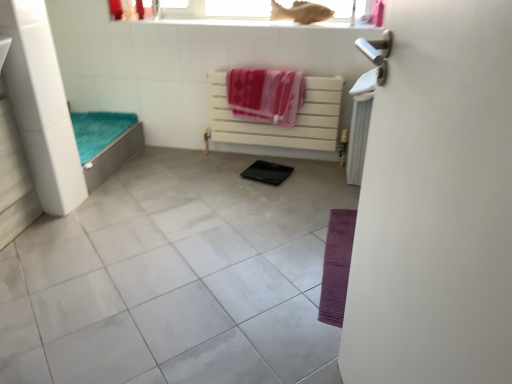
Question: Which is correct: white glossy screen door at right is inside pink fabric beach towel at center, acting as the first beach towel starting from the left, or outside of it?

Choices:
 (A) inside
 (B) outside

Answer: (B)

Question: Considering their positions, is white glossy screen door at right located in front of or behind pink fabric beach towel at center, which ranks as the second beach towel in right-to-left order?

Choices:
 (A) behind
 (B) front

Answer: (B)

Question: Which object is positioned closest to the white glossy tile at center?

Choices:
 (A) white plastic radiator at center
 (B) pink fabric beach towel at upper right, positioned as the 1th beach towel in right-to-left order
 (C) pink fabric beach towel at center, acting as the first beach towel starting from the left
 (D) matte plastic fish at upper center
 (E) white glossy screen door at right

Answer: (C)

Question: Which of these objects is positioned closest to the matte plastic fish at upper center?

Choices:
 (A) white plastic radiator at center
 (B) pink fabric beach towel at center, which ranks as the second beach towel in right-to-left order
 (C) pink fabric beach towel at upper right, placed as the 2th beach towel when sorted from left to right
 (D) white glossy tile at center
 (E) white glossy screen door at right

Answer: (B)